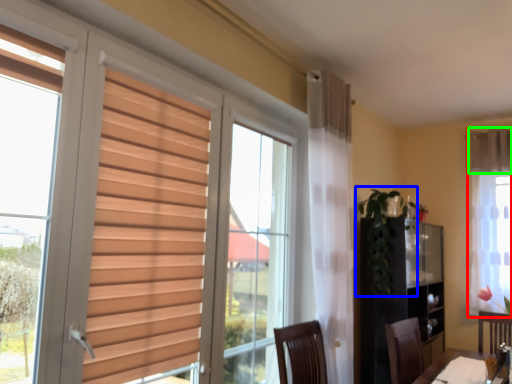
Question: Based on their relative distances, which object is farther from curtain (highlighted by a red box)? Choose from plant (highlighted by a blue box) and curtain (highlighted by a green box).

Choices:
 (A) plant
 (B) curtain

Answer: (A)